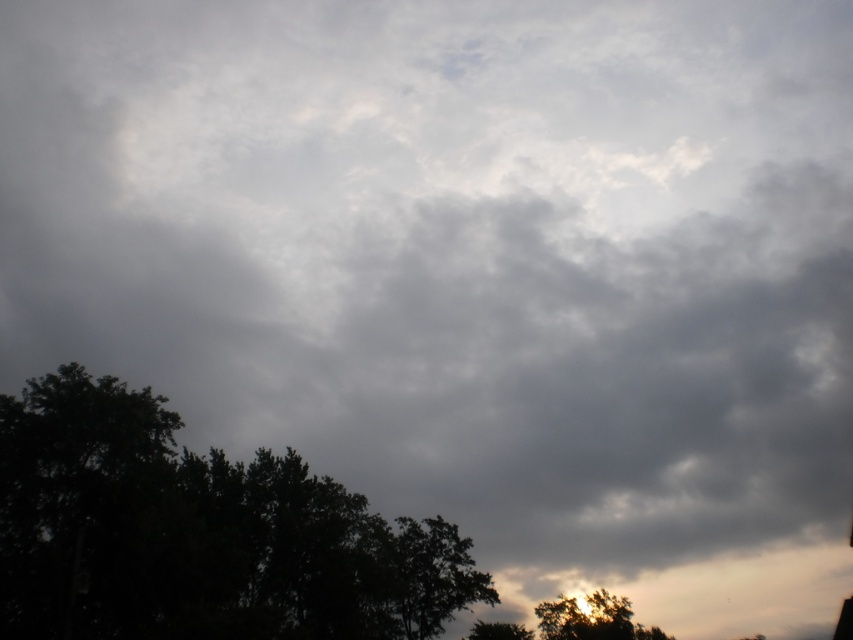
In the scene shown: Is green leafy tree at lower left below golden textured tree at lower right?

No.

Is green leafy tree at lower left wider than golden textured tree at lower right?

Indeed, green leafy tree at lower left has a greater width compared to golden textured tree at lower right.

Where is `green leafy tree at lower left`? green leafy tree at lower left is located at coordinates (196, 532).

What do you see at coordinates (196, 532) in the screenshot? I see `green leafy tree at lower left` at bounding box center [196, 532].

Can you confirm if green leafy tree at lower left is positioned above green leafy tree at lower center?

Yes, green leafy tree at lower left is above green leafy tree at lower center.

Which is behind, point (291, 573) or point (485, 634)?

Point (485, 634)

This screenshot has height=640, width=853. In order to click on green leafy tree at lower left in this screenshot , I will do pos(196,532).

From the picture: Which is more to the left, golden textured tree at lower right or green leafy tree at lower center?

From the viewer's perspective, green leafy tree at lower center appears more on the left side.

Between point (576, 637) and point (479, 628), which one is positioned in front?

Point (479, 628) is in front.

Identify the location of golden textured tree at lower right. This screenshot has height=640, width=853. (592, 620).